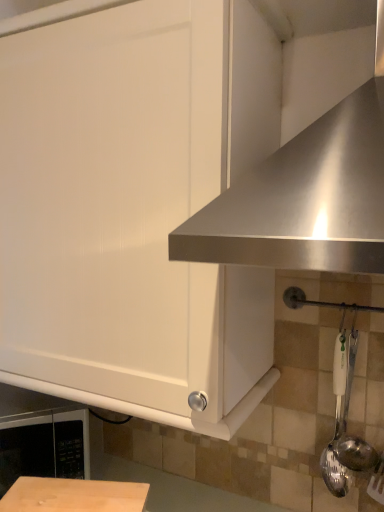
Question: Is satin silver spoon at right, acting as the first utensil starting from the left, wider than white matte cabinet at upper left?

Choices:
 (A) yes
 (B) no

Answer: (B)

Question: Is satin silver spoon at right, acting as the first utensil starting from the left, positioned in front of white matte cabinet at upper left?

Choices:
 (A) yes
 (B) no

Answer: (B)

Question: From a real-world perspective, is satin silver spoon at right, acting as the first utensil starting from the left, on top of white matte cabinet at upper left?

Choices:
 (A) yes
 (B) no

Answer: (B)

Question: Considering the relative sizes of satin silver spoon at right, acting as the first utensil starting from the left, and white matte cabinet at upper left in the image provided, is satin silver spoon at right, acting as the first utensil starting from the left, shorter than white matte cabinet at upper left?

Choices:
 (A) no
 (B) yes

Answer: (B)

Question: Can you confirm if satin silver spoon at right, acting as the first utensil starting from the left, is thinner than white matte cabinet at upper left?

Choices:
 (A) yes
 (B) no

Answer: (A)

Question: Would you say satin silver spoon at right, which ranks as the 2th utensil in right-to-left order, is to the left or to the right of white matte cabinet at upper left in the picture?

Choices:
 (A) right
 (B) left

Answer: (A)

Question: Which is correct: satin silver spoon at right, which ranks as the 2th utensil in right-to-left order, is inside white matte cabinet at upper left, or outside of it?

Choices:
 (A) outside
 (B) inside

Answer: (A)

Question: From the image's perspective, is satin silver spoon at right, which ranks as the 2th utensil in right-to-left order, located above or below white matte cabinet at upper left?

Choices:
 (A) below
 (B) above

Answer: (A)

Question: Looking at the image, does satin silver spoon at right, acting as the first utensil starting from the left, seem bigger or smaller compared to white matte cabinet at upper left?

Choices:
 (A) small
 (B) big

Answer: (A)

Question: Considering their positions, is white plastic spoon at lower right, which appears as the 1th utensil when viewed from the right, located in front of or behind satin silver spoon at right, which ranks as the 2th utensil in right-to-left order?

Choices:
 (A) front
 (B) behind

Answer: (A)

Question: Is white plastic spoon at lower right, which appears as the 1th utensil when viewed from the right, wider or thinner than satin silver spoon at right, which ranks as the 2th utensil in right-to-left order?

Choices:
 (A) thin
 (B) wide

Answer: (B)

Question: From a real-world perspective, relative to satin silver spoon at right, which ranks as the 2th utensil in right-to-left order, is white plastic spoon at lower right, arranged as the second utensil when viewed from the left, vertically above or below?

Choices:
 (A) below
 (B) above

Answer: (B)

Question: From their relative heights in the image, would you say white plastic spoon at lower right, arranged as the second utensil when viewed from the left, is taller or shorter than satin silver spoon at right, which ranks as the 2th utensil in right-to-left order?

Choices:
 (A) short
 (B) tall

Answer: (A)

Question: In terms of height, does white plastic spoon at lower right, which appears as the 1th utensil when viewed from the right, look taller or shorter compared to stainless steel exhaust hood at upper right?

Choices:
 (A) short
 (B) tall

Answer: (A)

Question: From a real-world perspective, is white plastic spoon at lower right, arranged as the second utensil when viewed from the left, above or below stainless steel exhaust hood at upper right?

Choices:
 (A) above
 (B) below

Answer: (B)